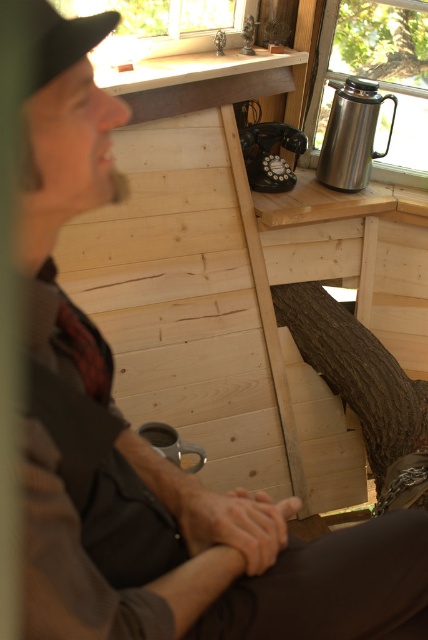
You are an interior designer planning to hang a picture frame between the dark brown wood tree trunk at center and the brown rough bark tree at upper right. Based on their positions, where should you place the frame to ensure it hangs between them?

The dark brown wood tree trunk at center is below the brown rough bark tree at upper right, so placing the picture frame between them would require hanging it above the dark brown wood tree trunk at center and below the brown rough bark tree at upper right.

You are planning to place a large potted plant in this cabin scene. The dark brown wood tree trunk at center and the brown rough bark tree at upper right are already present. Which of these two trees would you need to consider for space availability when placing the plant?

The dark brown wood tree trunk at center has a larger size compared to the brown rough bark tree at upper right, so you should consider the space around the dark brown wood tree trunk at center first for placing the large potted plant.

You are standing in the cabin and want to place a new plant pot exactly where the dark brown wood tree trunk at center is located. What are the coordinates you should aim for?

The coordinates for the dark brown wood tree trunk at center are at point [356,371].